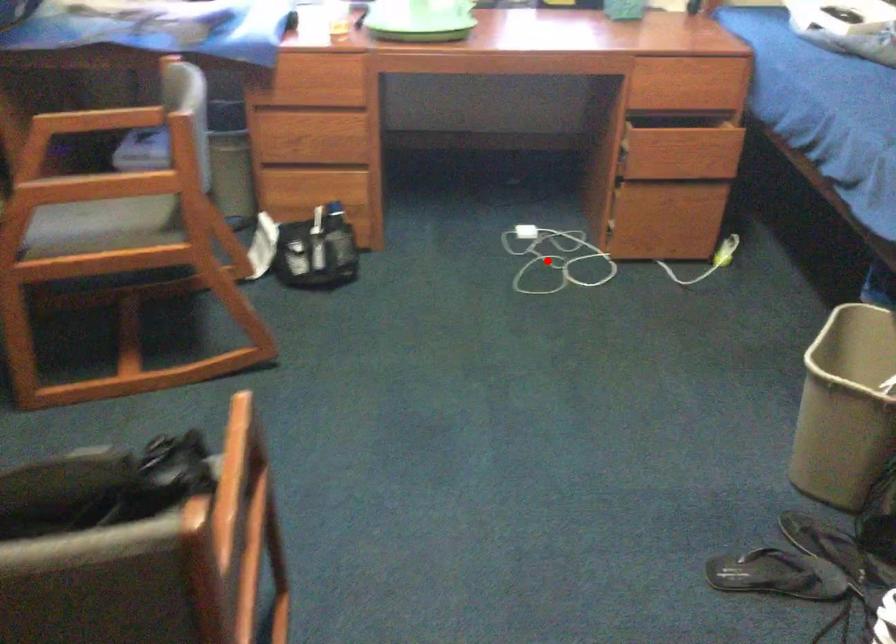
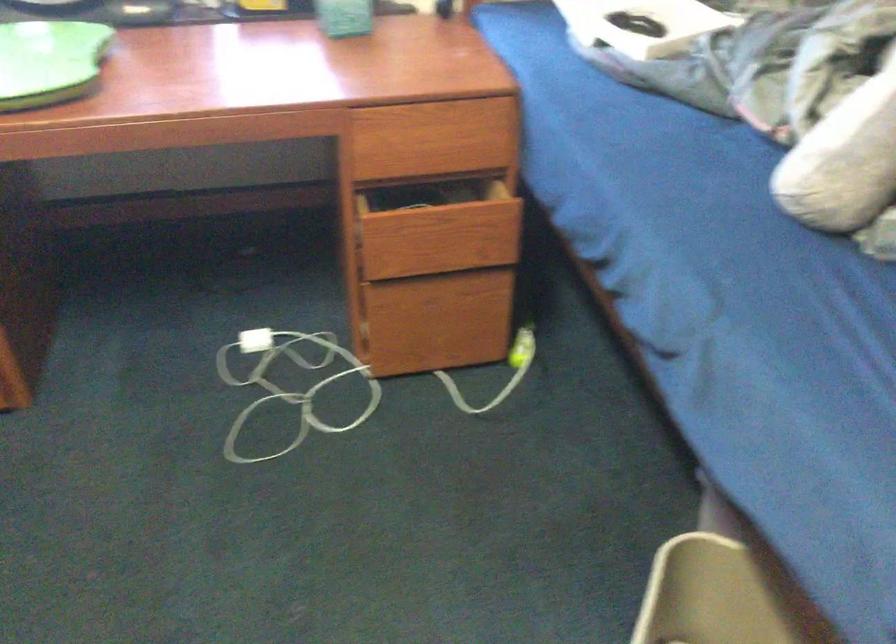
Question: I am providing you with two images of the same scene from different viewpoints. A red point is marked on the first image. Can you still see the location of the red point in image 2?

Choices:
 (A) Yes
 (B) No

Answer: (A)